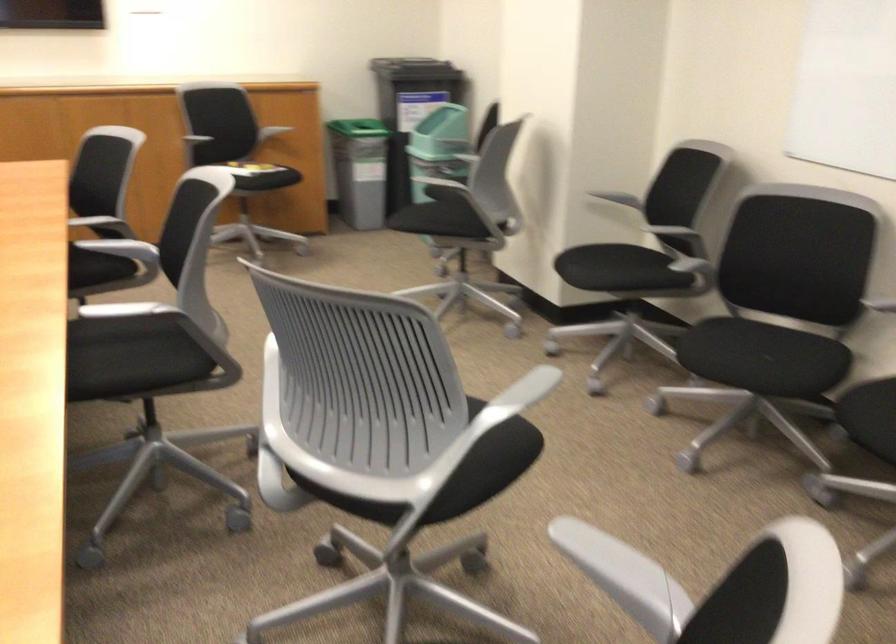
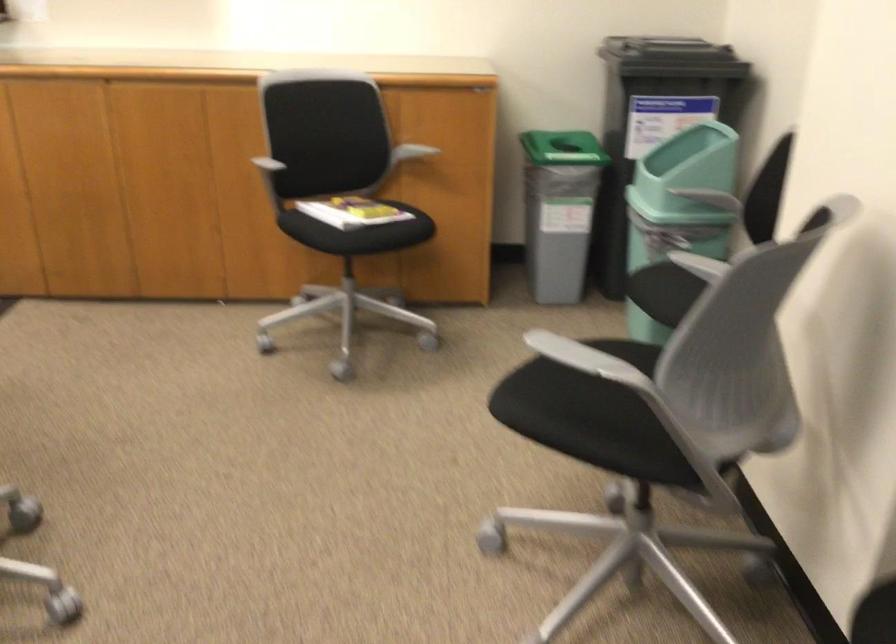
The point at (252, 151) is marked in the first image. Where is the corresponding point in the second image?

(351, 211)